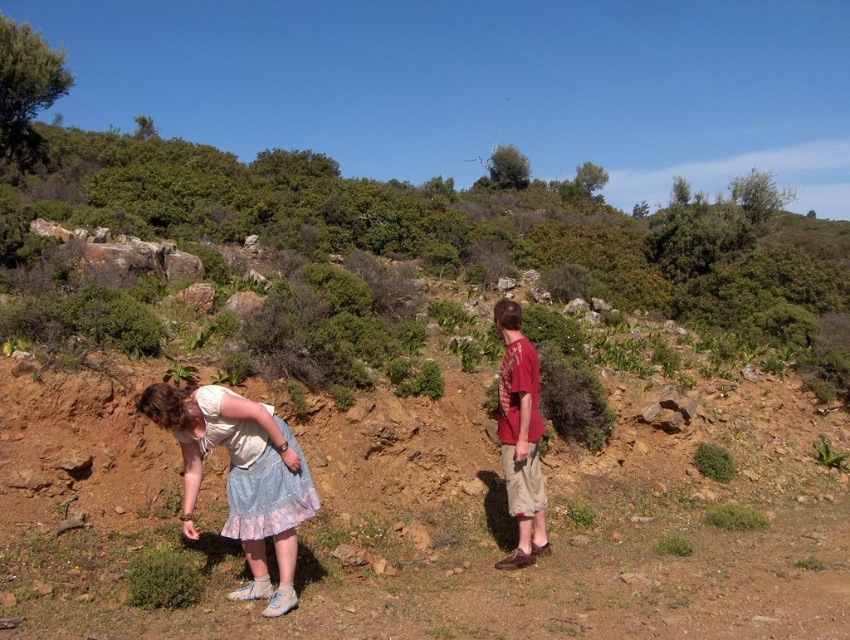
Question: Which of the following is the closest to the observer?

Choices:
 (A) white cotton shirt at lower left
 (B) light blue cotton skirt at lower left

Answer: (A)

Question: Considering the relative positions of light blue cotton skirt at lower left and matte red shirt at center in the image provided, where is light blue cotton skirt at lower left located with respect to matte red shirt at center?

Choices:
 (A) left
 (B) right

Answer: (A)

Question: Which point is farther from the camera taking this photo?

Choices:
 (A) (536, 484)
 (B) (259, 406)

Answer: (A)

Question: Does light blue cotton skirt at lower left come in front of matte red shirt at center?

Choices:
 (A) no
 (B) yes

Answer: (B)

Question: Observing the image, what is the correct spatial positioning of light blue cotton skirt at lower left in reference to white cotton shirt at lower left?

Choices:
 (A) above
 (B) below

Answer: (B)

Question: Which object is positioned farthest from the matte red shirt at center?

Choices:
 (A) white cotton shirt at lower left
 (B) light blue cotton skirt at lower left

Answer: (A)